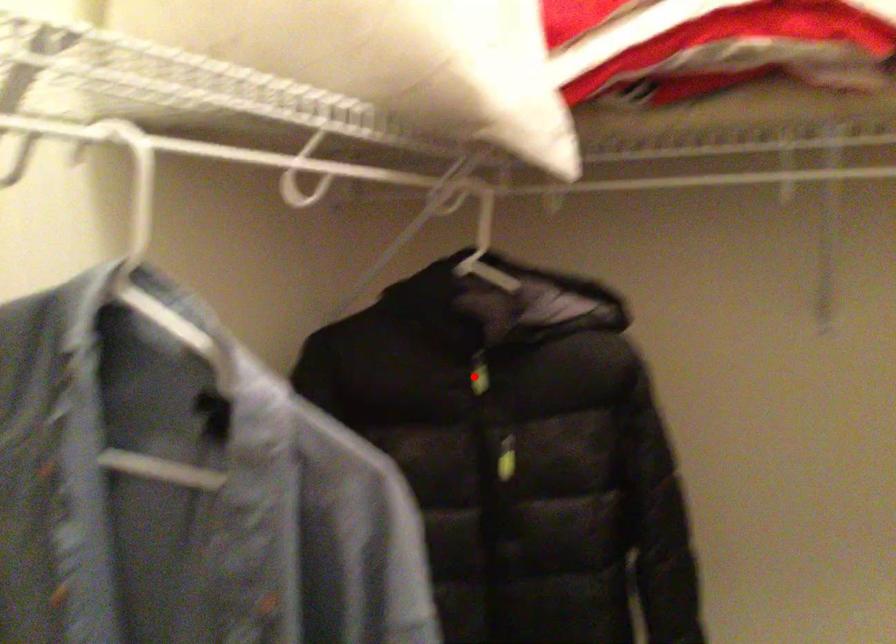
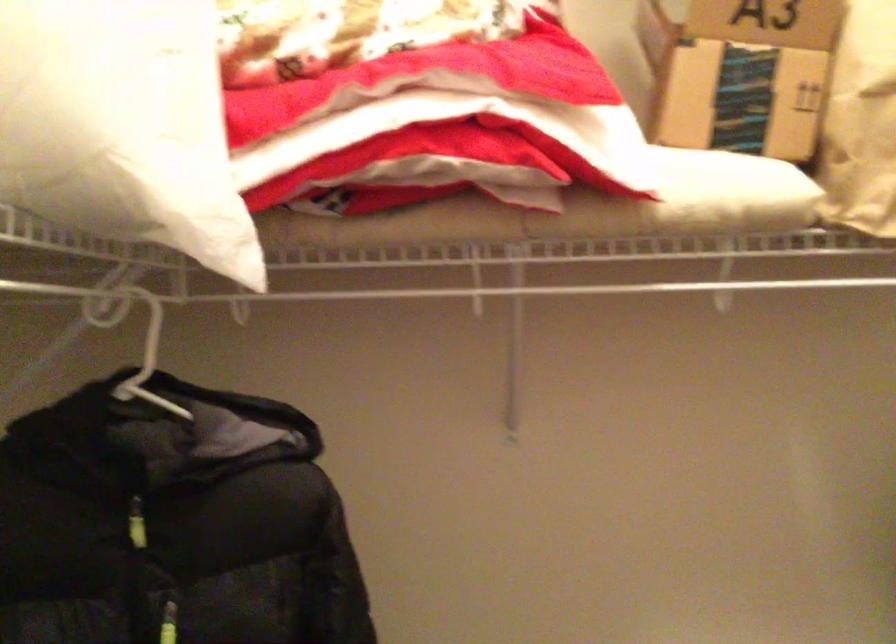
Question: I am providing you with two images of the same scene from different viewpoints. A red point is shown in image1. For the corresponding object point in image2, is it positioned nearer or farther from the camera?

Choices:
 (A) Nearer
 (B) Farther

Answer: (A)